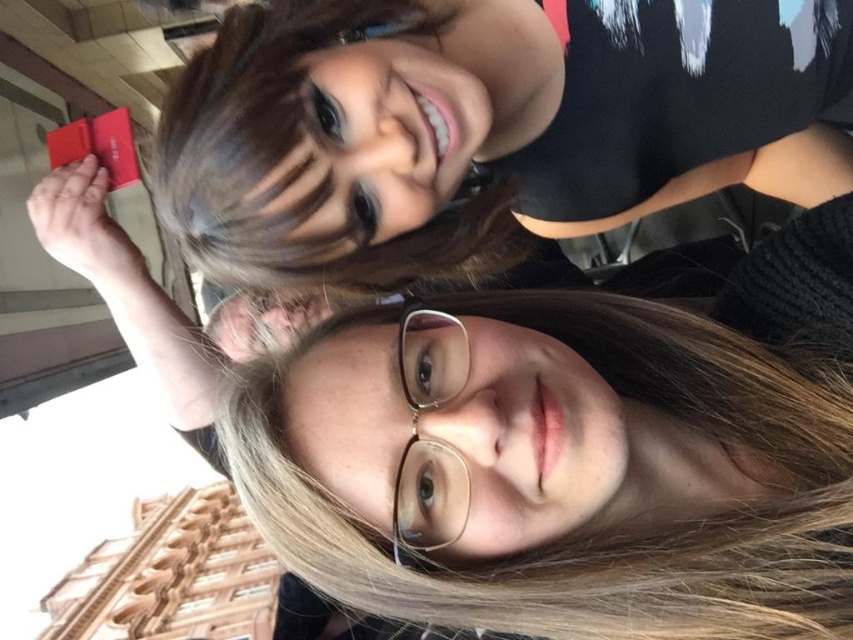
You are taking a photo of two people. You need to ensure that the brown shiny hair at upper center does not cover the gold metallic glasses at center. Based on their positions, is this possible?

The brown shiny hair at upper center is above the gold metallic glasses at center, so it is possible to adjust the angle or position to prevent the hair from covering the glasses.

You are taking a photo of two people. You notice the brown shiny hair at upper center and the gold metallic glasses at center. Which object in the photo is larger?

The brown shiny hair at upper center is bigger than the gold metallic glasses at center.

Consider the image. You are a photographer standing 20 inches away from the subject. You notice the matte black hair at upper center in the scene. Can you confirm if you are within the recommended 20 inches distance for a close portrait shot?

The matte black hair at upper center is 19.93 inches away from the viewer, which is within the recommended 20 inches distance for a close portrait shot.